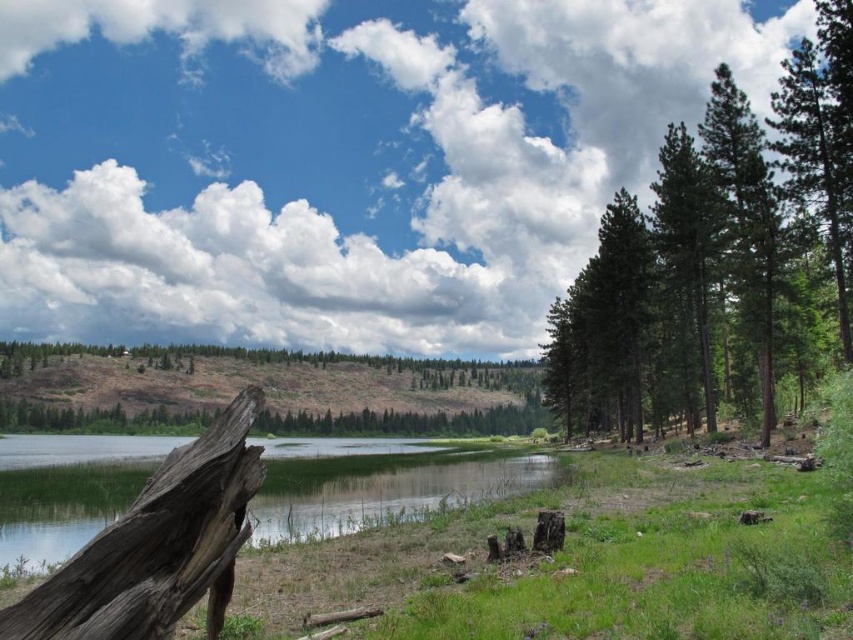
Question: Which point is farther from the camera taking this photo?

Choices:
 (A) (403, 493)
 (B) (778, 314)

Answer: (B)

Question: Can you confirm if green textured pine trees at right is bigger than clear water at lower left?

Choices:
 (A) yes
 (B) no

Answer: (B)

Question: Which object is closer to the camera taking this photo?

Choices:
 (A) green textured pine trees at right
 (B) clear water at lower left

Answer: (B)

Question: Considering the relative positions of green textured pine trees at right and clear water at lower left in the image provided, where is green textured pine trees at right located with respect to clear water at lower left?

Choices:
 (A) above
 (B) below

Answer: (A)

Question: Does green textured pine trees at right lie in front of clear water at lower left?

Choices:
 (A) no
 (B) yes

Answer: (A)